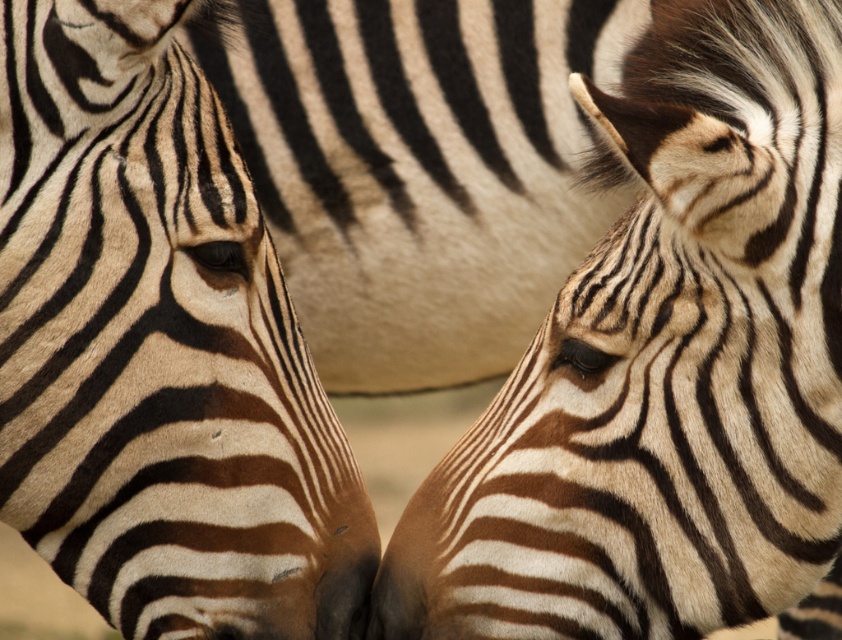
Question: Does black and white striped zebra at center have a lesser width compared to black matte nose at center?

Choices:
 (A) yes
 (B) no

Answer: (B)

Question: Among these objects, which one is farthest from the camera?

Choices:
 (A) black and white striped zebra head at right
 (B) black matte nose at center
 (C) black and white striped zebra at center

Answer: (B)

Question: Which of these objects is positioned closest to the black matte nose at center?

Choices:
 (A) black and white striped zebra head at right
 (B) black and white striped zebra at center

Answer: (B)

Question: Which point is closer to the camera?

Choices:
 (A) (320, 608)
 (B) (29, 97)
 (C) (669, 124)

Answer: (C)

Question: Is black and white striped zebra head at right closer to the viewer compared to black matte nose at center?

Choices:
 (A) no
 (B) yes

Answer: (B)

Question: Does black and white striped zebra head at right have a lesser width compared to black matte nose at center?

Choices:
 (A) yes
 (B) no

Answer: (B)